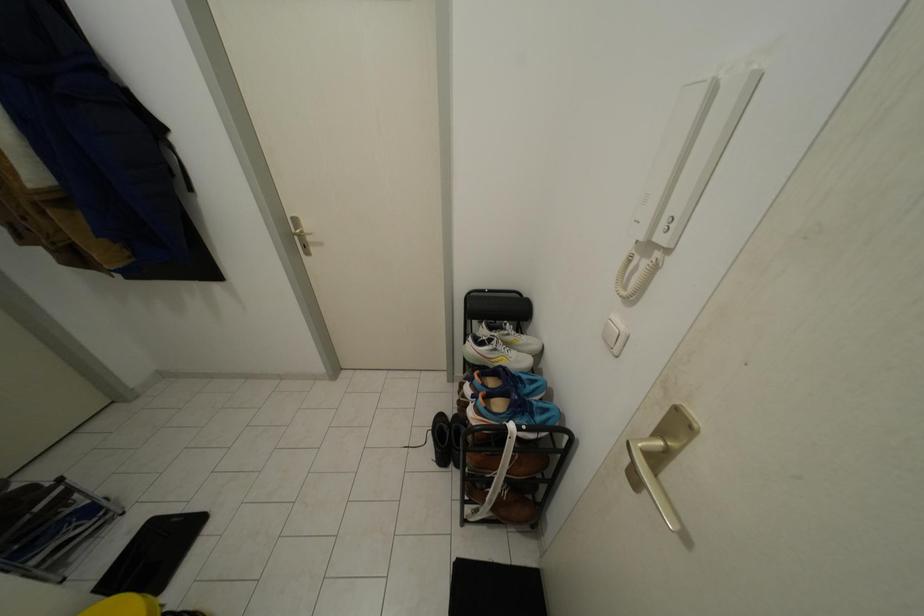
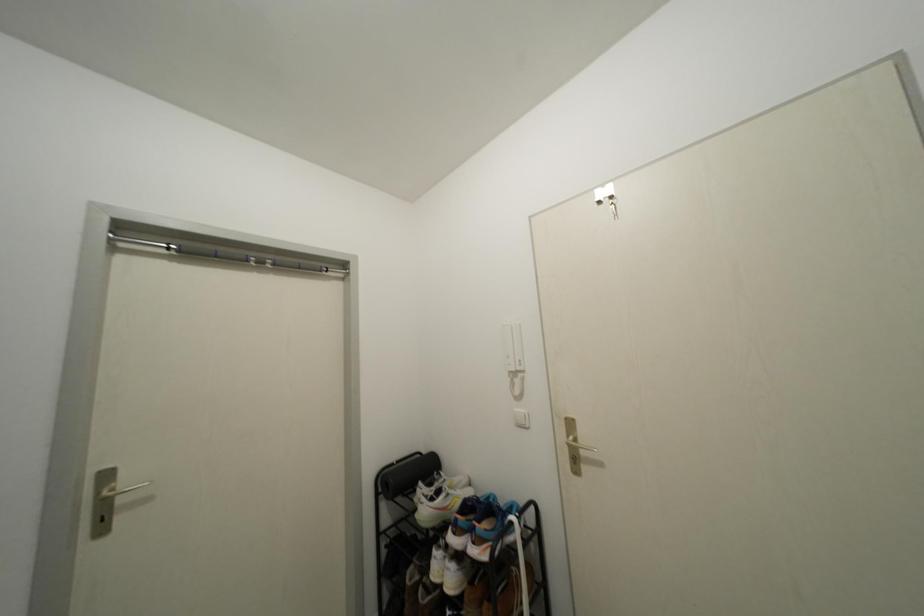
First-person continuous shooting, in which direction is the camera rotating?

The camera rotated toward right-up.